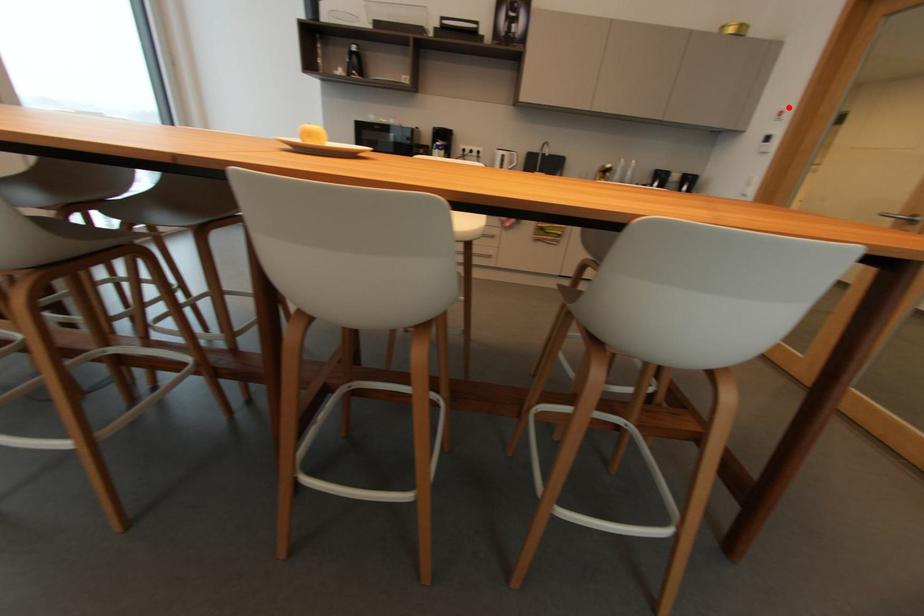
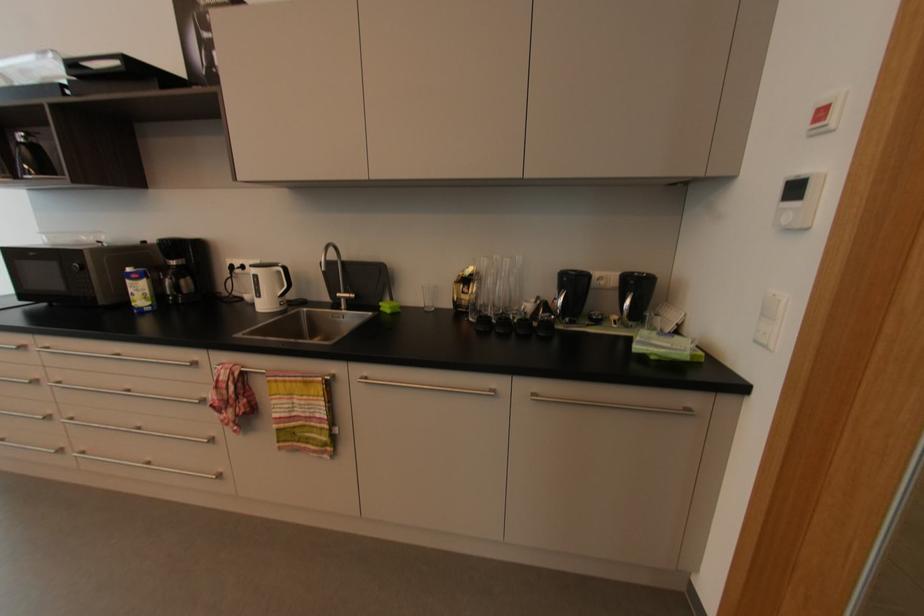
Question: A red point is marked in image1. In image2, is the corresponding 3D point closer to the camera or farther? Reply with the corresponding letter.

Choices:
 (A) The corresponding 3D point is closer.
 (B) The corresponding 3D point is farther.

Answer: (A)